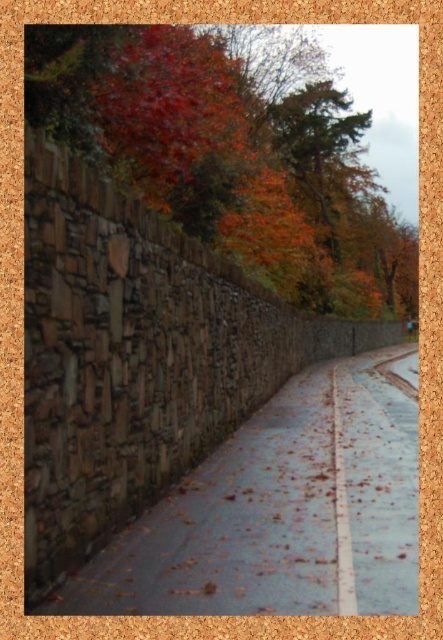
Question: Among these objects, which one is farthest from the camera?

Choices:
 (A) rustic stone path at center
 (B) autumn leaves at upper center

Answer: (B)

Question: Can you confirm if autumn leaves at upper center is smaller than rustic stone path at center?

Choices:
 (A) no
 (B) yes

Answer: (A)

Question: Which point is closer to the camera?

Choices:
 (A) rustic stone path at center
 (B) autumn leaves at upper center

Answer: (A)

Question: Can you confirm if autumn leaves at upper center is bigger than rustic stone path at center?

Choices:
 (A) yes
 (B) no

Answer: (A)

Question: In this image, where is autumn leaves at upper center located relative to rustic stone path at center?

Choices:
 (A) below
 (B) above

Answer: (B)